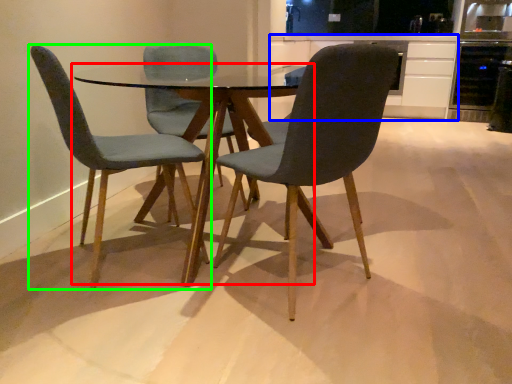
Question: Based on their relative distances, which object is nearer to coffee table (highlighted by a red box)? Choose from cabinetry (highlighted by a blue box) and chair (highlighted by a green box).

Choices:
 (A) cabinetry
 (B) chair

Answer: (B)